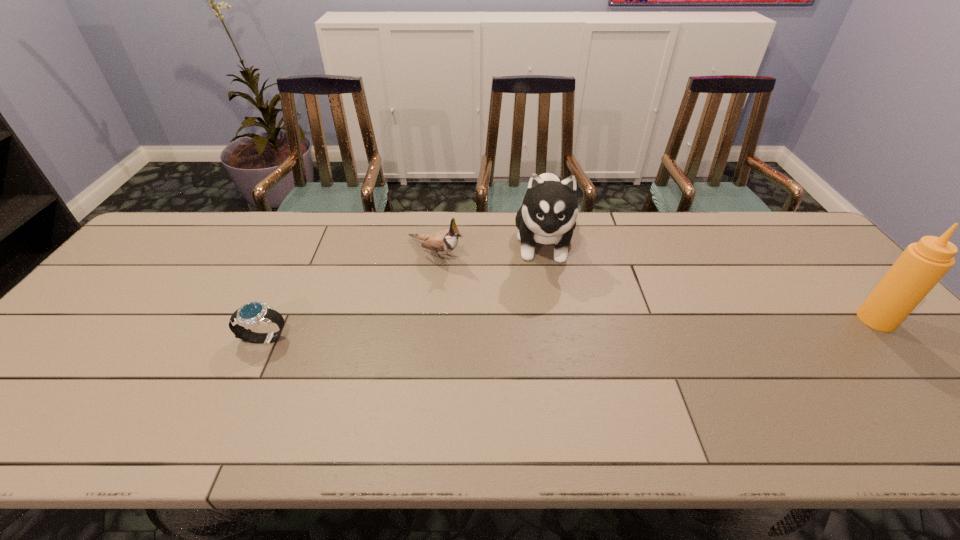
This screenshot has height=540, width=960. Find the location of `the shortest object`. the shortest object is located at coordinates (251, 314).

Find the location of `watch`. watch is located at coordinates tap(251, 314).

What are the coordinates of `the rightmost object` in the screenshot? It's located at (922, 265).

This screenshot has height=540, width=960. I want to click on puppy, so click(x=548, y=214).

Where is `the third object from right to left`? The image size is (960, 540). the third object from right to left is located at coordinates (444, 241).

In order to click on the third tallest object in this screenshot , I will do `click(444, 241)`.

Locate an element on the screen. The image size is (960, 540). blank area located 0.120m on the front of the watch is located at coordinates (238, 393).

Identify the location of vacant space located 0.340m on the left of the condiment. Image resolution: width=960 pixels, height=540 pixels. (728, 319).

Locate an element on the screen. Image resolution: width=960 pixels, height=540 pixels. free spot located 0.260m at the face of the puppy is located at coordinates (548, 354).

You are a GUI agent. You are given a task and a screenshot of the screen. Output one action in this format:
    pyautogui.click(x=<x>, y=<y>)
    Task: Click on the vacant space situated at the face of the puppy
    Image resolution: width=960 pixels, height=540 pixels.
    Given the screenshot: What is the action you would take?
    pyautogui.click(x=548, y=315)